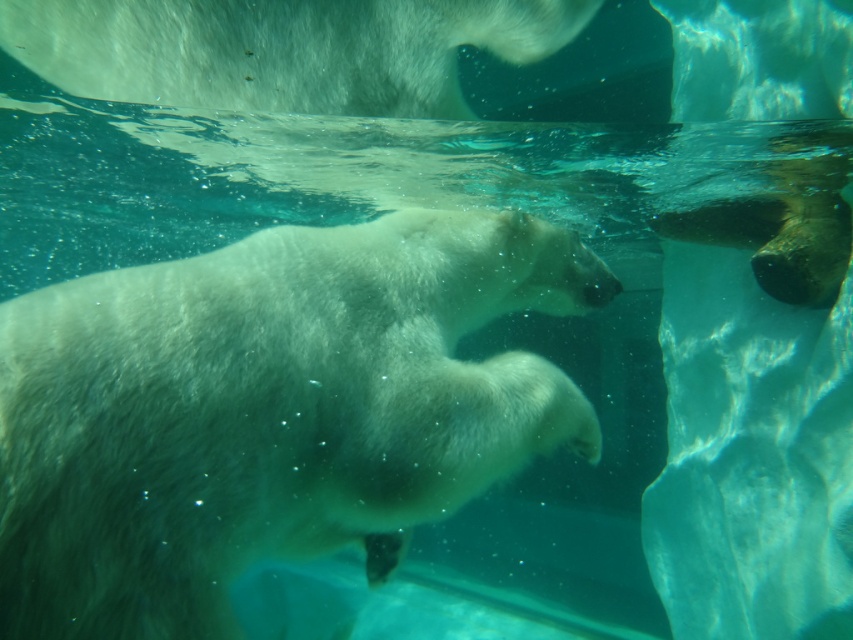
From the picture: Does white fur polar bear at center have a greater width compared to white fur polar bear at upper center?

Incorrect, white fur polar bear at center's width does not surpass white fur polar bear at upper center's.

Between white fur polar bear at center and white fur polar bear at upper center, which one appears on the left side from the viewer's perspective?

From the viewer's perspective, white fur polar bear at upper center appears more on the left side.

Does point (219, 332) lie behind point (473, 29)?

No, (219, 332) is closer to viewer.

Locate an element on the screen. The height and width of the screenshot is (640, 853). white fur polar bear at center is located at coordinates (268, 412).